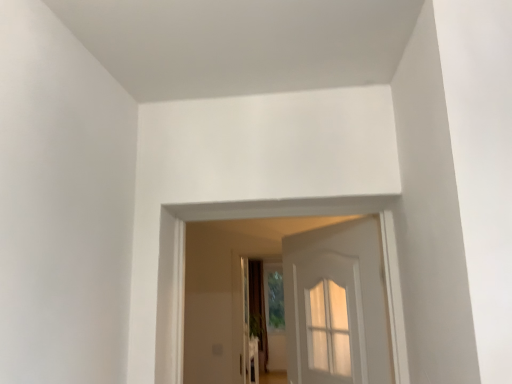
This screenshot has width=512, height=384. I want to click on brown fabric curtain at center, so click(258, 310).

What do you see at coordinates (258, 310) in the screenshot? I see `brown fabric curtain at center` at bounding box center [258, 310].

What is the approximate height of brown fabric curtain at center?

8.60 feet.

Based on the photo, in order to face white wooden door at center, should I rotate leftwards or rightwards?

It's best to rotate right around 9.462 degrees.

In order to click on white wooden door at center in this screenshot , I will do `click(336, 305)`.

What do you see at coordinates (336, 305) in the screenshot? I see `white wooden door at center` at bounding box center [336, 305].

Identify the location of brown fabric curtain at center. The width and height of the screenshot is (512, 384). (258, 310).

Is brown fabric curtain at center at the left side of white wooden door at center?

Yes.

Between brown fabric curtain at center and white wooden door at center, which one is positioned behind?

brown fabric curtain at center is further from the camera.

Is point (265, 328) positioned behind point (294, 285)?

Yes, it is.

From the image's perspective, would you say brown fabric curtain at center is shown under white wooden door at center?

Yes.

From a real-world perspective, is brown fabric curtain at center over white wooden door at center?

No, from a real-world perspective, brown fabric curtain at center is not over white wooden door at center

Considering the sizes of objects brown fabric curtain at center and white wooden door at center in the image provided, who is thinner, brown fabric curtain at center or white wooden door at center?

Thinner between the two is white wooden door at center.

Between brown fabric curtain at center and white wooden door at center, which one has less height?

white wooden door at center is shorter.

Can you confirm if brown fabric curtain at center is smaller than white wooden door at center?

Actually, brown fabric curtain at center might be larger than white wooden door at center.

Would you say brown fabric curtain at center is outside white wooden door at center?

Yes, brown fabric curtain at center is located beyond the bounds of white wooden door at center.

Is brown fabric curtain at center not close to white wooden door at center?

Yes, brown fabric curtain at center is far from white wooden door at center.

Is brown fabric curtain at center turned away from white wooden door at center?

No, brown fabric curtain at center is not facing the opposite direction of white wooden door at center.

Based on the photo, how different are the orientations of brown fabric curtain at center and white wooden door at center in degrees?

The angle between the facing direction of brown fabric curtain at center and the facing direction of white wooden door at center is 57.9 degrees.

This screenshot has width=512, height=384. Find the location of `curtain located behind the white wooden door at center`. curtain located behind the white wooden door at center is located at coordinates (258, 310).

Between white wooden door at center and brown fabric curtain at center, which one appears on the right side from the viewer's perspective?

white wooden door at center is more to the right.

Which object is closer to the camera taking this photo, white wooden door at center or brown fabric curtain at center?

white wooden door at center is in front.

Does point (349, 366) come behind point (264, 329)?

No, (349, 366) is in front of (264, 329).

From the image's perspective, which one is positioned higher, white wooden door at center or brown fabric curtain at center?

white wooden door at center, from the image's perspective.

From a real-world perspective, who is located higher, white wooden door at center or brown fabric curtain at center?

white wooden door at center.

Which of these two, white wooden door at center or brown fabric curtain at center, is thinner?

With smaller width is white wooden door at center.

Which of these two, white wooden door at center or brown fabric curtain at center, stands shorter?

white wooden door at center.

Does white wooden door at center have a larger size compared to brown fabric curtain at center?

No, white wooden door at center is not bigger than brown fabric curtain at center.

Would you say white wooden door at center is outside brown fabric curtain at center?

Absolutely, white wooden door at center is external to brown fabric curtain at center.

Are white wooden door at center and brown fabric curtain at center far apart?

white wooden door at center is positioned a significant distance from brown fabric curtain at center.

Is white wooden door at center positioned with its back to brown fabric curtain at center?

No, white wooden door at center's orientation is not away from brown fabric curtain at center.

How many degrees apart are the facing directions of white wooden door at center and brown fabric curtain at center?

57.9 degrees separate the facing orientations of white wooden door at center and brown fabric curtain at center.

How distant is white wooden door at center from brown fabric curtain at center?

They are 8.06 feet apart.

Locate an element on the screen. The height and width of the screenshot is (384, 512). door on the right of the brown fabric curtain at center is located at coordinates (336, 305).

The height and width of the screenshot is (384, 512). What are the coordinates of `door in front of the brown fabric curtain at center` in the screenshot? It's located at (336, 305).

At what (x,y) coordinates should I click in order to perform the action: click on curtain that appears on the left of white wooden door at center. Please return your answer as a coordinate pair (x, y). Looking at the image, I should click on (258, 310).